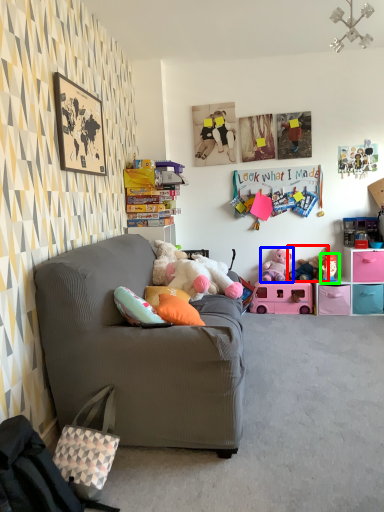
Question: Based on their relative distances, which object is farther from toy (highlighted by a red box)? Choose from toy (highlighted by a blue box) and toy (highlighted by a green box).

Choices:
 (A) toy
 (B) toy

Answer: (A)